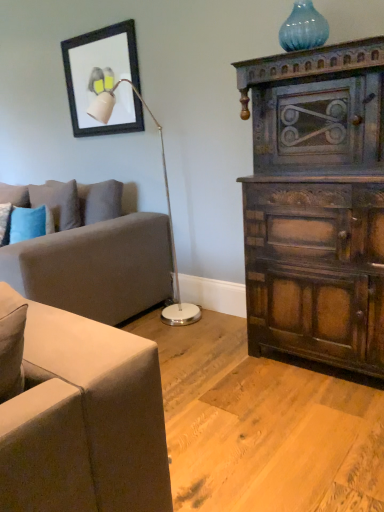
The image size is (384, 512). What are the coordinates of `vacant space in front of white glossy floor lamp at upper left` in the screenshot? It's located at tap(193, 351).